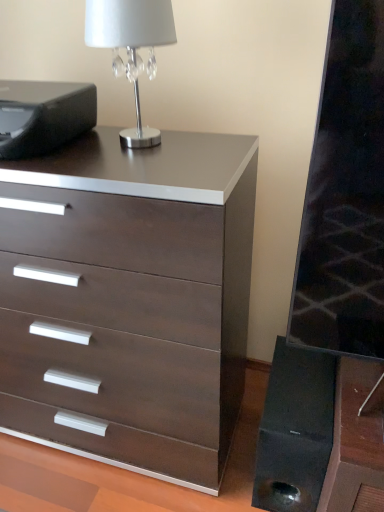
Question: From the image's perspective, is silver metallic table lamp at upper left located above black matte speaker at lower right?

Choices:
 (A) no
 (B) yes

Answer: (B)

Question: Is silver metallic table lamp at upper left facing away from black matte speaker at lower right?

Choices:
 (A) no
 (B) yes

Answer: (A)

Question: Does silver metallic table lamp at upper left have a larger size compared to black matte speaker at lower right?

Choices:
 (A) yes
 (B) no

Answer: (B)

Question: Are silver metallic table lamp at upper left and black matte speaker at lower right beside each other?

Choices:
 (A) no
 (B) yes

Answer: (A)

Question: Is silver metallic table lamp at upper left wider than black matte speaker at lower right?

Choices:
 (A) no
 (B) yes

Answer: (A)

Question: Would you say silver metallic table lamp at upper left contains black matte speaker at lower right?

Choices:
 (A) yes
 (B) no

Answer: (B)

Question: From the image's perspective, is black matte speaker at lower right above silver metallic table lamp at upper left?

Choices:
 (A) yes
 (B) no

Answer: (B)

Question: Is black matte speaker at lower right looking in the opposite direction of silver metallic table lamp at upper left?

Choices:
 (A) yes
 (B) no

Answer: (B)

Question: Does black matte speaker at lower right come in front of silver metallic table lamp at upper left?

Choices:
 (A) yes
 (B) no

Answer: (B)

Question: Is black matte speaker at lower right completely or partially outside of silver metallic table lamp at upper left?

Choices:
 (A) no
 (B) yes

Answer: (B)

Question: Could you tell me if black matte speaker at lower right is facing silver metallic table lamp at upper left?

Choices:
 (A) no
 (B) yes

Answer: (A)

Question: Does black matte speaker at lower right appear on the right side of silver metallic table lamp at upper left?

Choices:
 (A) yes
 (B) no

Answer: (A)

Question: Can silver metallic table lamp at upper left be found inside dark wood/matte chest of drawers at center?

Choices:
 (A) yes
 (B) no

Answer: (B)